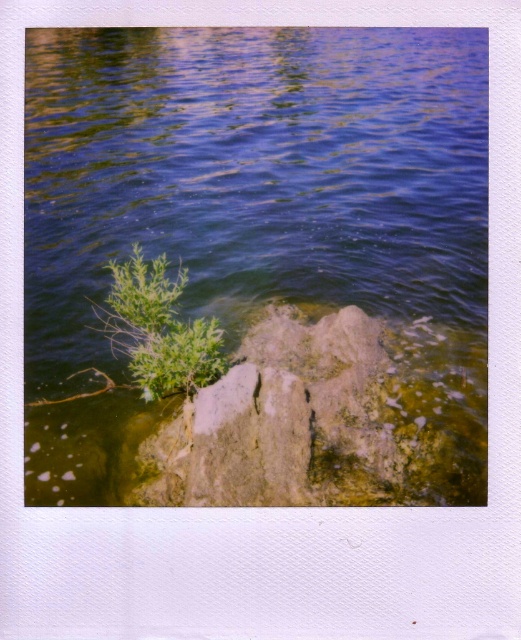
You are standing at the origin point in the scene. Which of the two points, point [217,308] or point [194,349], is closer to you?

Point [194,349] is closer to you because it is in front of point [217,308].

You are standing at the edge of the scene and want to reach the green leafy plant at upper left. Do you need to walk over the blue water at center first?

The blue water at center is closer to the viewer than the green leafy plant at upper left, so you would have to walk through the blue water at center before reaching the green leafy plant at upper left.

You are a botanist studying the growth patterns of plants in rocky environments. You observe the blue water at center and the green leafy plant at upper left in the scene. Which object takes up more space in the image?

The blue water at center has a larger size compared to the green leafy plant at upper left, so it takes up more space in the image.